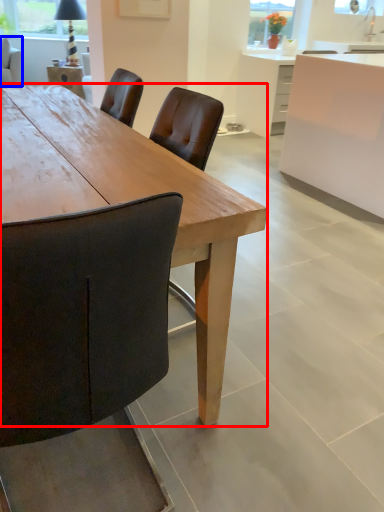
Question: Which object is closer to the camera taking this photo, desk (highlighted by a red box) or chair (highlighted by a blue box)?

Choices:
 (A) desk
 (B) chair

Answer: (A)